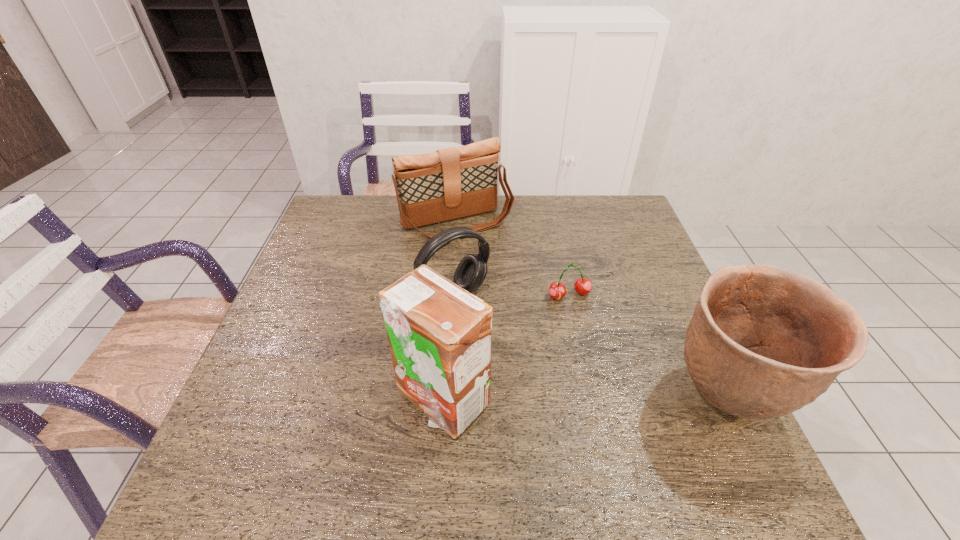
Where is `vacant space located 0.220m with stems pointing upwards on the fourth object from left to right`? vacant space located 0.220m with stems pointing upwards on the fourth object from left to right is located at coordinates (612, 373).

This screenshot has height=540, width=960. What are the coordinates of `free space located 0.210m with stems pointing upwards on the fourth object from left to right` in the screenshot? It's located at (610, 369).

Where is `free space located 0.320m with stems pointing upwards on the fourth object from left to right`? free space located 0.320m with stems pointing upwards on the fourth object from left to right is located at coordinates (633, 411).

Identify the location of vacant space located 0.350m on the earcups of the headset. (561, 414).

This screenshot has width=960, height=540. Identify the location of vacant space situated on the earcups of the headset. (534, 383).

Where is `vacant space located on the earcups of the headset`? vacant space located on the earcups of the headset is located at coordinates (576, 433).

This screenshot has height=540, width=960. Find the location of `object present at the far edge`. object present at the far edge is located at coordinates (448, 184).

Identify the location of carton located in the near edge section of the desktop. The height and width of the screenshot is (540, 960). (440, 336).

Where is `pottery that is at the near edge`? This screenshot has height=540, width=960. pottery that is at the near edge is located at coordinates (764, 341).

The height and width of the screenshot is (540, 960). Find the location of `object that is at the right edge`. object that is at the right edge is located at coordinates coord(764,341).